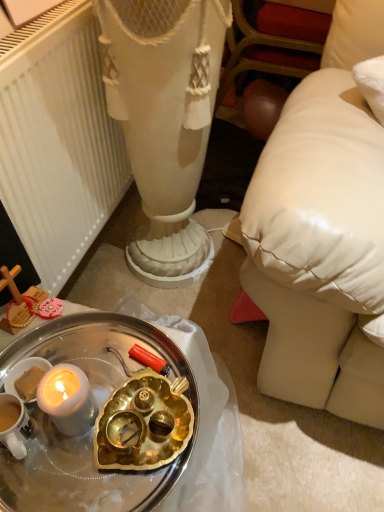
This screenshot has height=512, width=384. In order to click on vacant space underneath white metallic tray at lower left (from a real-world perspective) in this screenshot , I will do `click(94, 420)`.